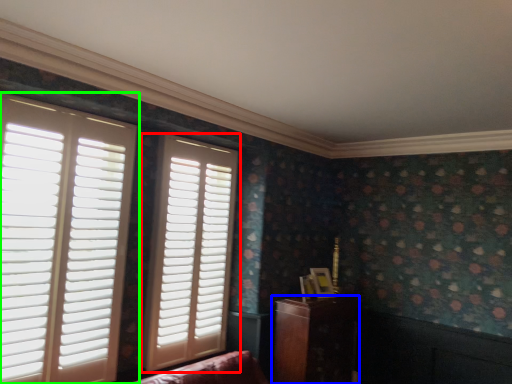
Question: Which object is positioned farthest from window (highlighted by a red box)? Select from furniture (highlighted by a blue box) and window (highlighted by a green box).

Choices:
 (A) furniture
 (B) window

Answer: (A)